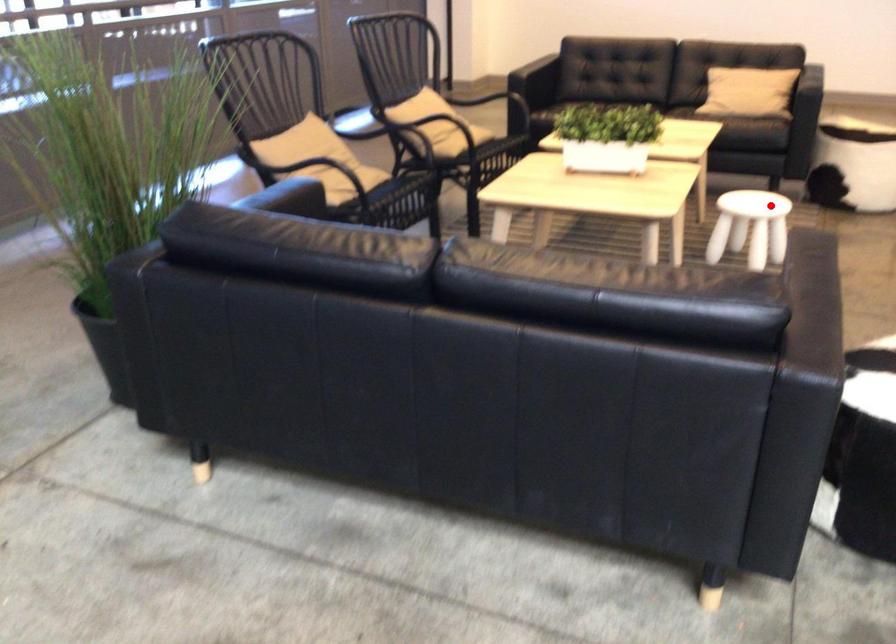
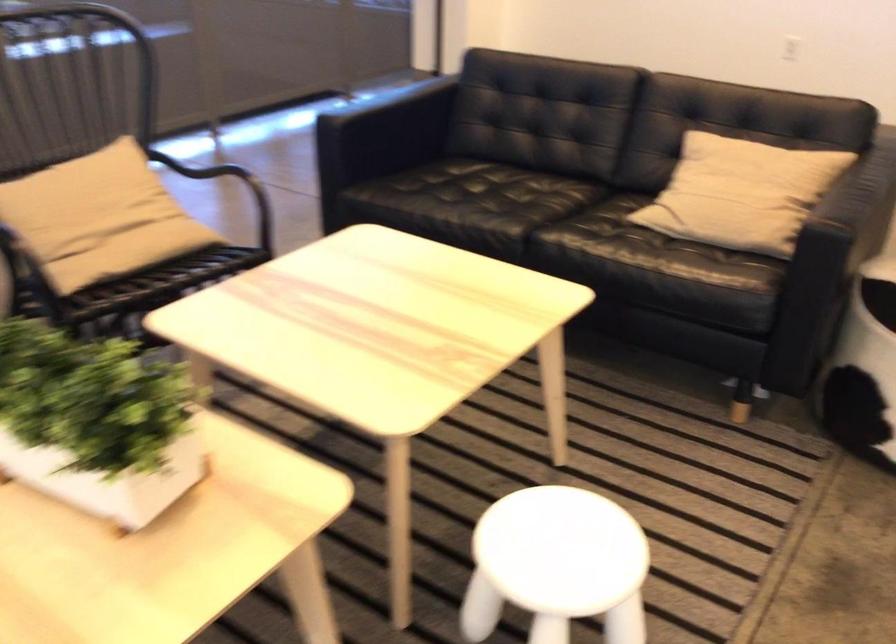
The point at the highlighted location is marked in the first image. Where is the corresponding point in the second image?

(556, 565)